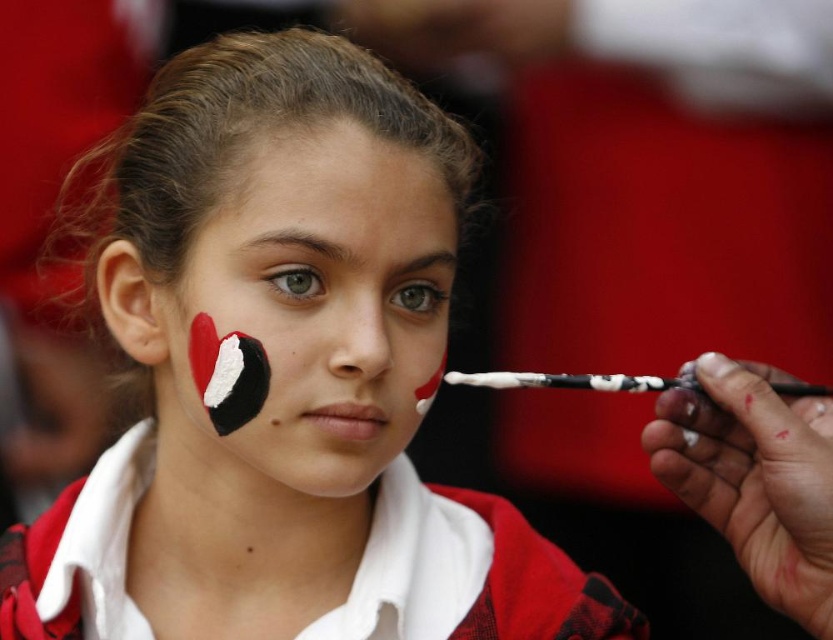
Question: Can you confirm if matte black face paint at center is bigger than white matte paint at center?

Choices:
 (A) no
 (B) yes

Answer: (B)

Question: Among these objects, which one is farthest from the camera?

Choices:
 (A) matte black face paint at center
 (B) white matte paint at center

Answer: (B)

Question: Which point appears closest to the camera in this image?

Choices:
 (A) (355, 205)
 (B) (257, 536)

Answer: (A)

Question: Observing the image, what is the correct spatial positioning of matte black face paint at center in reference to white matte paint at center?

Choices:
 (A) left
 (B) right

Answer: (A)

Question: Is matte black face paint at center below white matte paint at center?

Choices:
 (A) yes
 (B) no

Answer: (B)